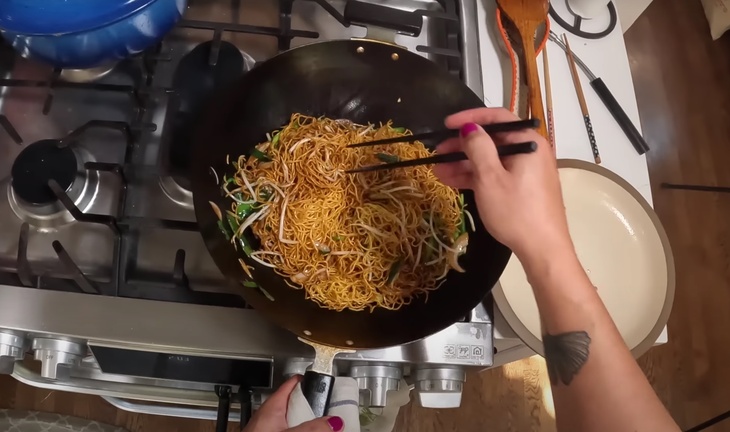
The height and width of the screenshot is (432, 730). Find the location of `pot`. pot is located at coordinates (112, 52).